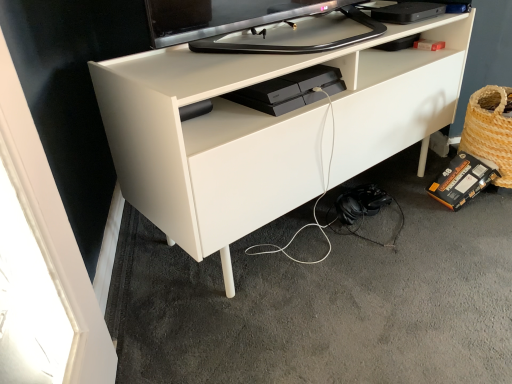
At what (x,y) coordinates should I click in order to perform the action: click on free space in front of white matte desk at center. Please return your answer as a coordinate pair (x, y). The height and width of the screenshot is (384, 512). Looking at the image, I should click on (346, 307).